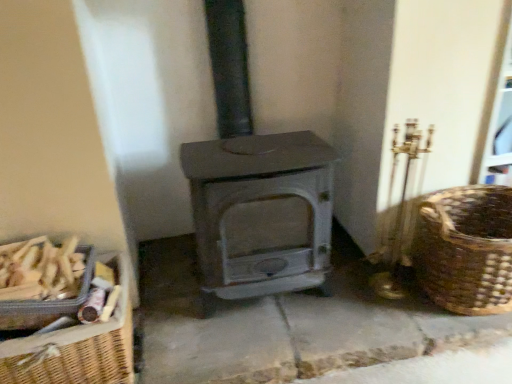
You are a GUI agent. You are given a task and a screenshot of the screen. Output one action in this format:
    pyautogui.click(x=<x>, y=<y>)
    Task: Click on the brown woven basket at right, placed as the 1th basket when sorted from right to left
    This screenshot has height=384, width=512.
    Given the screenshot: What is the action you would take?
    466,249

What do you see at coordinates (77, 346) in the screenshot? I see `woven wood basket at left, arranged as the 2th basket when viewed from the right` at bounding box center [77, 346].

The width and height of the screenshot is (512, 384). In order to click on brown woven basket at right, which is the 3th basket in left-to-right order in this screenshot , I will do tap(466, 249).

Locate an element on the screen. the 1st basket counting from the left side of the brown woven basket at right, placed as the 1th basket when sorted from right to left is located at coordinates (77, 346).

Is woven wood basket at left, arranged as the 2th basket when viewed from the right, to the right of brown woven basket at right, placed as the 1th basket when sorted from right to left, from the viewer's perspective?

In fact, woven wood basket at left, arranged as the 2th basket when viewed from the right, is to the left of brown woven basket at right, placed as the 1th basket when sorted from right to left.

Considering their positions, is woven wood basket at left, the second basket viewed from the left, located in front of or behind brown woven basket at right, which is the 3th basket in left-to-right order?

woven wood basket at left, the second basket viewed from the left, is in front of brown woven basket at right, which is the 3th basket in left-to-right order.

Does woven wood basket at left, arranged as the 2th basket when viewed from the right, have a greater width compared to brown woven basket at right, placed as the 1th basket when sorted from right to left?

No.

From the image's perspective, between matte gray wood burning stove at center and brown woven basket at right, which is the 3th basket in left-to-right order, who is located below?

brown woven basket at right, which is the 3th basket in left-to-right order, appears lower in the image.

Between matte gray wood burning stove at center and brown woven basket at right, which is the 3th basket in left-to-right order, which one has smaller size?

brown woven basket at right, which is the 3th basket in left-to-right order, is smaller.

Is matte gray wood burning stove at center wider or thinner than brown woven basket at right, placed as the 1th basket when sorted from right to left?

In the image, matte gray wood burning stove at center appears to be wider than brown woven basket at right, placed as the 1th basket when sorted from right to left.

Consider the image. Is matte gray wood burning stove at center not within brown woven basket at right, which is the 3th basket in left-to-right order?

That's correct, matte gray wood burning stove at center is outside of brown woven basket at right, which is the 3th basket in left-to-right order.

From a real-world perspective, between brown woven basket at right, which is the 3th basket in left-to-right order, and woven brown basket at lower left, which is the 3th basket in right-to-left order, who is vertically higher?

woven brown basket at lower left, which is the 3th basket in right-to-left order, is physically above.

What's the angular difference between brown woven basket at right, which is the 3th basket in left-to-right order, and woven brown basket at lower left, placed as the 1th basket when sorted from left to right,'s facing directions?

There is a 2.3-degree angle between the facing directions of brown woven basket at right, which is the 3th basket in left-to-right order, and woven brown basket at lower left, placed as the 1th basket when sorted from left to right.

Is brown woven basket at right, which is the 3th basket in left-to-right order, not inside woven brown basket at lower left, placed as the 1th basket when sorted from left to right?

brown woven basket at right, which is the 3th basket in left-to-right order, is positioned outside woven brown basket at lower left, placed as the 1th basket when sorted from left to right.

Does woven brown basket at lower left, placed as the 1th basket when sorted from left to right, have a lesser width compared to brown woven basket at right, which is the 3th basket in left-to-right order?

Yes, woven brown basket at lower left, placed as the 1th basket when sorted from left to right, is thinner than brown woven basket at right, which is the 3th basket in left-to-right order.

Is woven brown basket at lower left, which is the 3th basket in right-to-left order, inside or outside of brown woven basket at right, which is the 3th basket in left-to-right order?

The correct answer is: outside.

Between woven brown basket at lower left, which is the 3th basket in right-to-left order, and brown woven basket at right, which is the 3th basket in left-to-right order, which one appears on the right side from the viewer's perspective?

Positioned to the right is brown woven basket at right, which is the 3th basket in left-to-right order.

Based on the photo, from the image's perspective, would you say woven brown basket at lower left, which is the 3th basket in right-to-left order, is positioned over brown woven basket at right, which is the 3th basket in left-to-right order?

No, from the image's perspective, woven brown basket at lower left, which is the 3th basket in right-to-left order, is not over brown woven basket at right, which is the 3th basket in left-to-right order.

Is brown woven basket at right, placed as the 1th basket when sorted from right to left, far away from matte gray wood burning stove at center?

No, brown woven basket at right, placed as the 1th basket when sorted from right to left, is not far away from matte gray wood burning stove at center.

Looking at this image, from a real-world perspective, which is physically below, brown woven basket at right, which is the 3th basket in left-to-right order, or matte gray wood burning stove at center?

brown woven basket at right, which is the 3th basket in left-to-right order.

Identify the location of wood burning stove above the brown woven basket at right, placed as the 1th basket when sorted from right to left (from the image's perspective). The width and height of the screenshot is (512, 384). (255, 187).

Considering the relative sizes of brown woven basket at right, placed as the 1th basket when sorted from right to left, and matte gray wood burning stove at center in the image provided, is brown woven basket at right, placed as the 1th basket when sorted from right to left, thinner than matte gray wood burning stove at center?

Yes, brown woven basket at right, placed as the 1th basket when sorted from right to left, is thinner than matte gray wood burning stove at center.

Is point (310, 184) closer to viewer compared to point (91, 377)?

No, it is behind (91, 377).

From a real-world perspective, is matte gray wood burning stove at center under woven wood basket at left, arranged as the 2th basket when viewed from the right?

Incorrect, from a real-world perspective, matte gray wood burning stove at center is higher than woven wood basket at left, arranged as the 2th basket when viewed from the right.

Considering the sizes of objects matte gray wood burning stove at center and woven wood basket at left, arranged as the 2th basket when viewed from the right, in the image provided, who is wider, matte gray wood burning stove at center or woven wood basket at left, arranged as the 2th basket when viewed from the right,?

matte gray wood burning stove at center.

Could you measure the distance between matte gray wood burning stove at center and woven wood basket at left, the second basket viewed from the left?

They are 21.83 inches apart.

Which object is closer to the camera taking this photo, woven brown basket at lower left, placed as the 1th basket when sorted from left to right, or woven wood basket at left, the second basket viewed from the left?

woven wood basket at left, the second basket viewed from the left, is closer to the camera.

From the image's perspective, which basket is the 1st one above the woven wood basket at left, arranged as the 2th basket when viewed from the right? Please provide its 2D coordinates.

[(47, 301)]

Who is smaller, woven brown basket at lower left, placed as the 1th basket when sorted from left to right, or woven wood basket at left, arranged as the 2th basket when viewed from the right?

woven brown basket at lower left, placed as the 1th basket when sorted from left to right, is smaller.

Is woven brown basket at lower left, placed as the 1th basket when sorted from left to right, with woven wood basket at left, arranged as the 2th basket when viewed from the right?

There is a gap between woven brown basket at lower left, placed as the 1th basket when sorted from left to right, and woven wood basket at left, arranged as the 2th basket when viewed from the right.

Where is `the 2nd basket above when counting from the woven wood basket at left, arranged as the 2th basket when viewed from the right (from the image's perspective)`? This screenshot has width=512, height=384. the 2nd basket above when counting from the woven wood basket at left, arranged as the 2th basket when viewed from the right (from the image's perspective) is located at coordinates (466, 249).

At what (x,y) coordinates should I click in order to perform the action: click on wood burning stove located in front of the brown woven basket at right, which is the 3th basket in left-to-right order. Please return your answer as a coordinate pair (x, y). The height and width of the screenshot is (384, 512). Looking at the image, I should click on (255, 187).

Which object lies nearer to the anchor point woven wood basket at left, arranged as the 2th basket when viewed from the right, matte gray wood burning stove at center or woven brown basket at lower left, which is the 3th basket in right-to-left order?

woven brown basket at lower left, which is the 3th basket in right-to-left order, lies closer to woven wood basket at left, arranged as the 2th basket when viewed from the right, than the other object.

Which object lies further to the anchor point brown woven basket at right, placed as the 1th basket when sorted from right to left, woven wood basket at left, arranged as the 2th basket when viewed from the right, or woven brown basket at lower left, placed as the 1th basket when sorted from left to right?

The object further to brown woven basket at right, placed as the 1th basket when sorted from right to left, is woven brown basket at lower left, placed as the 1th basket when sorted from left to right.

When comparing their distances from woven wood basket at left, the second basket viewed from the left, does woven brown basket at lower left, placed as the 1th basket when sorted from left to right, or brown woven basket at right, placed as the 1th basket when sorted from right to left, seem further?

Based on the image, brown woven basket at right, placed as the 1th basket when sorted from right to left, appears to be further to woven wood basket at left, the second basket viewed from the left.

Considering their positions, is woven wood basket at left, arranged as the 2th basket when viewed from the right, positioned closer to woven brown basket at lower left, placed as the 1th basket when sorted from left to right, than brown woven basket at right, placed as the 1th basket when sorted from right to left?

Among the two, woven wood basket at left, arranged as the 2th basket when viewed from the right, is located nearer to woven brown basket at lower left, placed as the 1th basket when sorted from left to right.

Considering their positions, is woven wood basket at left, arranged as the 2th basket when viewed from the right, positioned closer to matte gray wood burning stove at center than woven brown basket at lower left, which is the 3th basket in right-to-left order?

woven wood basket at left, arranged as the 2th basket when viewed from the right.

Which object lies further to the anchor point brown woven basket at right, which is the 3th basket in left-to-right order, matte gray wood burning stove at center or woven brown basket at lower left, which is the 3th basket in right-to-left order?

woven brown basket at lower left, which is the 3th basket in right-to-left order.

Based on the photo, when comparing their distances from woven brown basket at lower left, placed as the 1th basket when sorted from left to right, does matte gray wood burning stove at center or brown woven basket at right, which is the 3th basket in left-to-right order, seem closer?

matte gray wood burning stove at center lies closer to woven brown basket at lower left, placed as the 1th basket when sorted from left to right, than the other object.

From the image, which object appears to be nearer to woven wood basket at left, the second basket viewed from the left, woven brown basket at lower left, placed as the 1th basket when sorted from left to right, or matte gray wood burning stove at center?

Based on the image, woven brown basket at lower left, placed as the 1th basket when sorted from left to right, appears to be nearer to woven wood basket at left, the second basket viewed from the left.

Where is `basket between woven brown basket at lower left, placed as the 1th basket when sorted from left to right, and matte gray wood burning stove at center, in the horizontal direction`? basket between woven brown basket at lower left, placed as the 1th basket when sorted from left to right, and matte gray wood burning stove at center, in the horizontal direction is located at coordinates (77, 346).

You are a GUI agent. You are given a task and a screenshot of the screen. Output one action in this format:
    pyautogui.click(x=<x>, y=<y>)
    Task: Click on the wood burning stove between woven brown basket at lower left, which is the 3th basket in right-to-left order, and brown woven basket at right, which is the 3th basket in left-to-right order
    
    Given the screenshot: What is the action you would take?
    pyautogui.click(x=255, y=187)

You are a GUI agent. You are given a task and a screenshot of the screen. Output one action in this format:
    pyautogui.click(x=<x>, y=<y>)
    Task: Click on the wood burning stove between woven wood basket at left, the second basket viewed from the left, and brown woven basket at right, placed as the 1th basket when sorted from right to left, from left to right
    This screenshot has width=512, height=384.
    Given the screenshot: What is the action you would take?
    pyautogui.click(x=255, y=187)

Where is `basket between woven brown basket at lower left, which is the 3th basket in right-to-left order, and brown woven basket at right, placed as the 1th basket when sorted from right to left, in the horizontal direction`? Image resolution: width=512 pixels, height=384 pixels. basket between woven brown basket at lower left, which is the 3th basket in right-to-left order, and brown woven basket at right, placed as the 1th basket when sorted from right to left, in the horizontal direction is located at coordinates (77, 346).